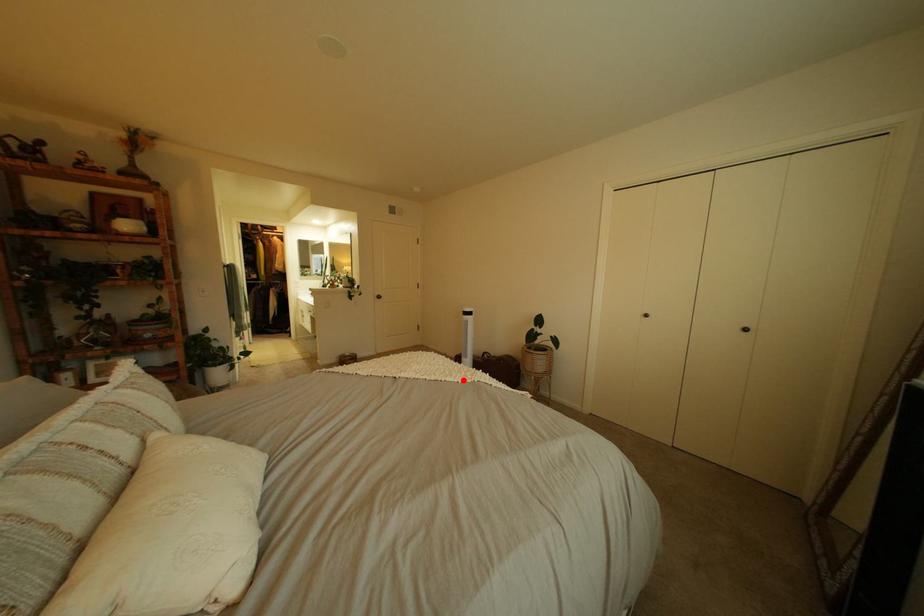
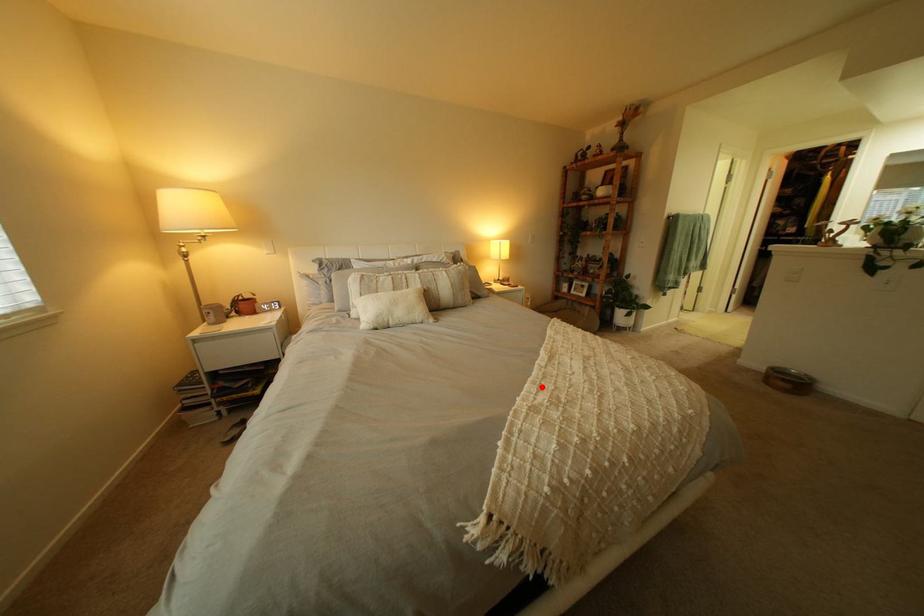
I am providing you with two images of the same scene from different viewpoints. A red point is marked on the first image and another point is marked on the second image. Are the points marked in image1 and image2 representing the same 3D position?

Yes